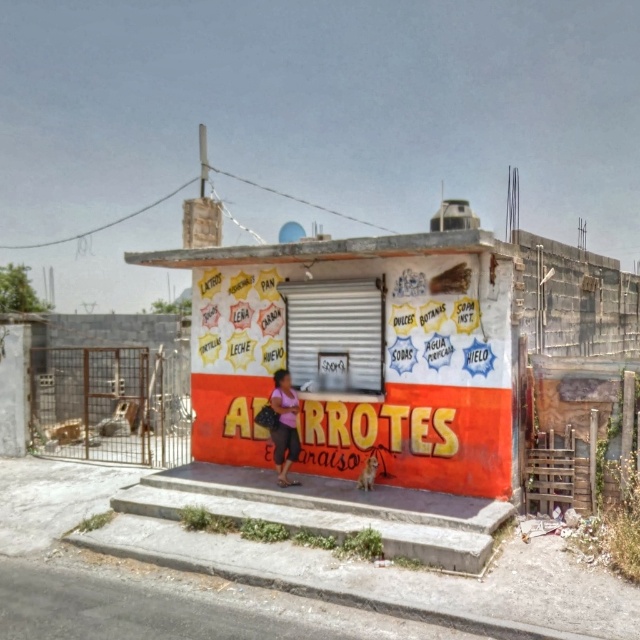
Question: Which object is closer to the camera taking this photo?

Choices:
 (A) orange painted wall at center
 (B) pink fabric dress at center

Answer: (A)

Question: Does orange painted wall at center lie behind pink fabric dress at center?

Choices:
 (A) yes
 (B) no

Answer: (B)

Question: Is the position of orange painted wall at center more distant than that of pink fabric dress at center?

Choices:
 (A) no
 (B) yes

Answer: (A)

Question: Which point is closer to the camera?

Choices:
 (A) pink fabric dress at center
 (B) orange painted wall at center

Answer: (B)

Question: Does orange painted wall at center appear on the left side of pink fabric dress at center?

Choices:
 (A) no
 (B) yes

Answer: (A)